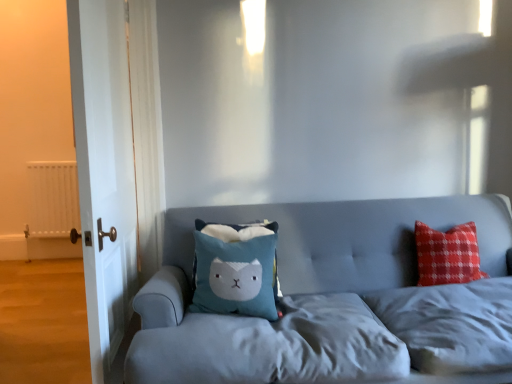
Where is `vacant point above white matte radiator at left (from a real-world perspective)`? The image size is (512, 384). vacant point above white matte radiator at left (from a real-world perspective) is located at coordinates (45, 163).